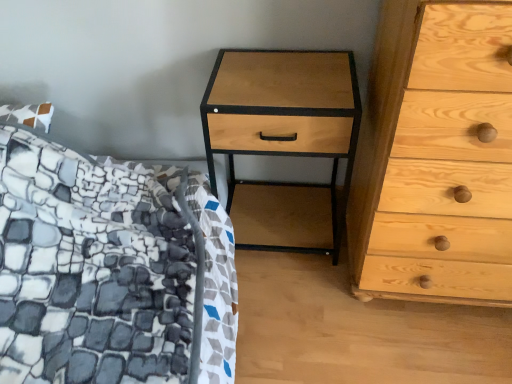
Question: Considering the positions of natural wood chest of drawers at right and natural wood nightstand at center in the image, is natural wood chest of drawers at right wider or thinner than natural wood nightstand at center?

Choices:
 (A) wide
 (B) thin

Answer: (A)

Question: Does point (503, 291) appear closer or farther from the camera than point (312, 105)?

Choices:
 (A) closer
 (B) farther

Answer: (B)

Question: In terms of size, does natural wood chest of drawers at right appear bigger or smaller than natural wood nightstand at center?

Choices:
 (A) small
 (B) big

Answer: (B)

Question: From a real-world perspective, is natural wood nightstand at center above or below natural wood chest of drawers at right?

Choices:
 (A) below
 (B) above

Answer: (A)

Question: Is natural wood nightstand at center inside the boundaries of natural wood chest of drawers at right, or outside?

Choices:
 (A) outside
 (B) inside

Answer: (A)

Question: Considering the positions of natural wood nightstand at center and natural wood chest of drawers at right in the image, is natural wood nightstand at center wider or thinner than natural wood chest of drawers at right?

Choices:
 (A) wide
 (B) thin

Answer: (B)

Question: Considering the positions of natural wood nightstand at center and natural wood chest of drawers at right in the image, is natural wood nightstand at center taller or shorter than natural wood chest of drawers at right?

Choices:
 (A) short
 (B) tall

Answer: (A)